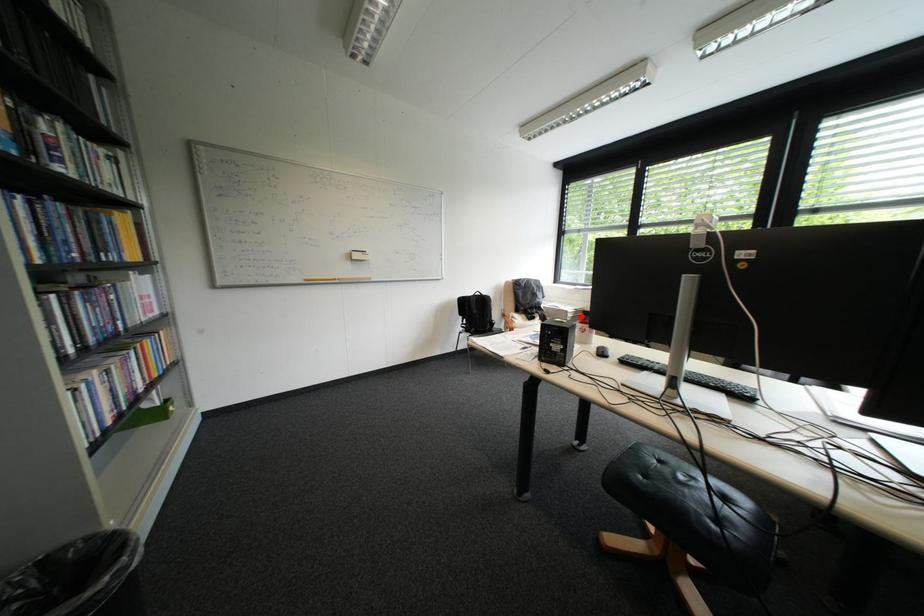
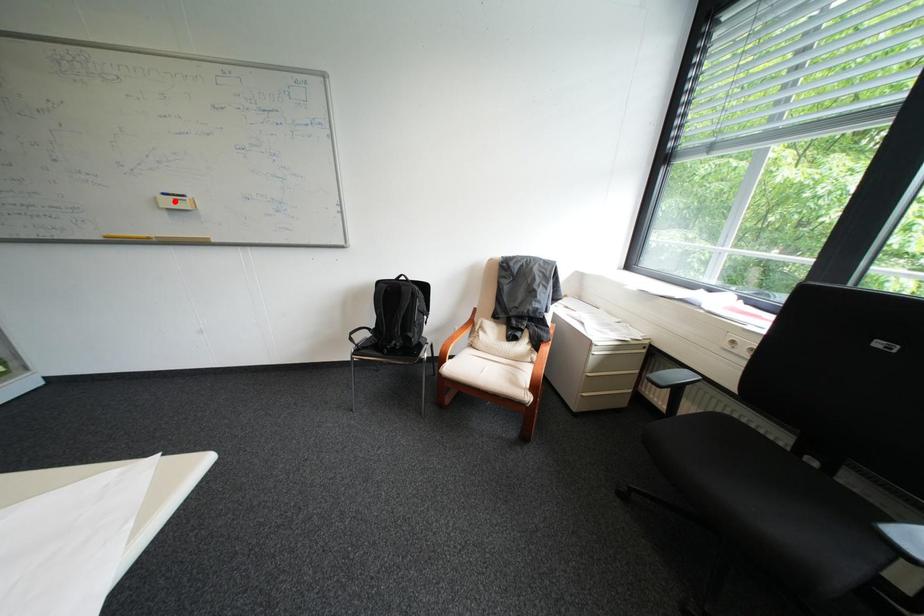
I am providing you with two images of the same scene from different viewpoints. A red point is marked on the first image and another point is marked on the second image. Does the point marked in image1 correspond to the same location as the one in image2?

No